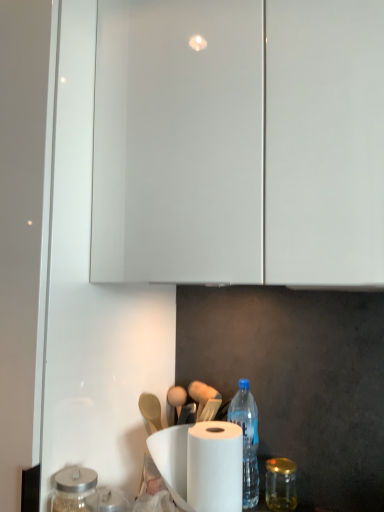
Question: Is point (89, 480) closer or farther from the camera than point (286, 480)?

Choices:
 (A) closer
 (B) farther

Answer: (A)

Question: From a real-world perspective, is transparent glass jar at lower left, which ranks as the second glass jar in back-to-front order, above or below gold metallic jar at lower right, which ranks as the first glass jar in back-to-front order?

Choices:
 (A) below
 (B) above

Answer: (B)

Question: Based on their relative distances, which object is nearer to the transparent glass jar at lower left, the first glass jar in the front-to-back sequence?

Choices:
 (A) blue plastic bottle at lower center
 (B) gold metallic jar at lower right, which ranks as the first glass jar in right-to-left order

Answer: (A)

Question: Which is nearer to the gold metallic jar at lower right, positioned as the 2th glass jar in left-to-right order?

Choices:
 (A) blue plastic bottle at lower center
 (B) transparent glass jar at lower left, marked as the first glass jar in a left-to-right arrangement

Answer: (A)